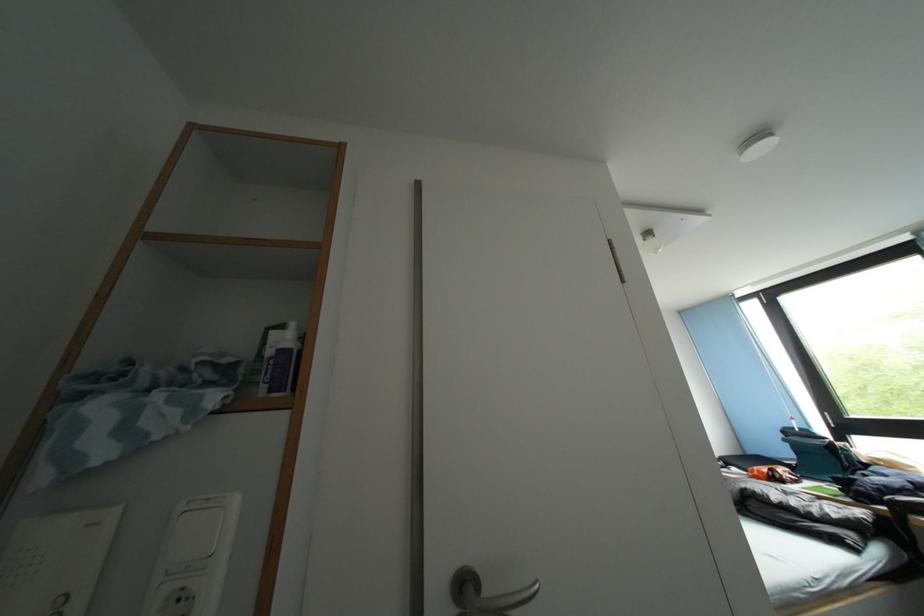
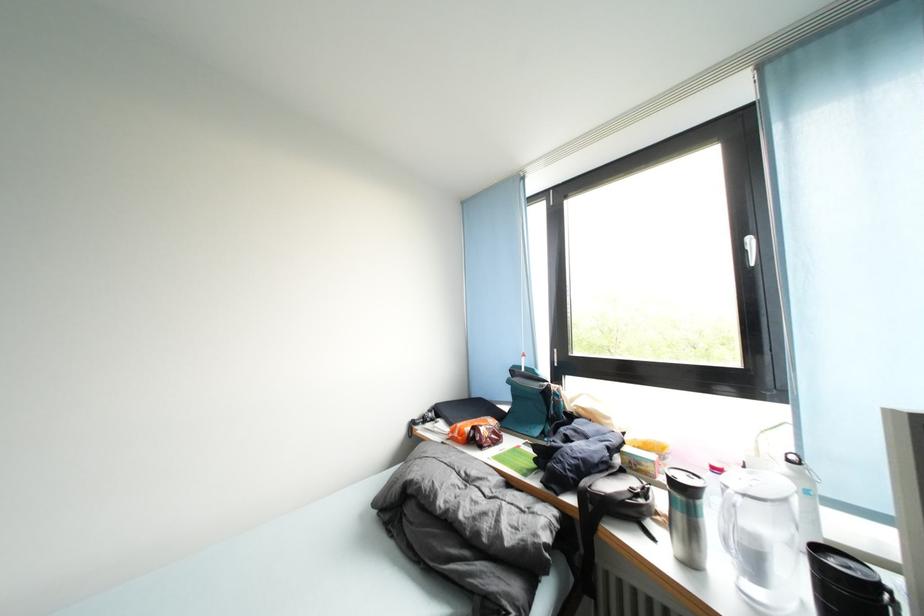
Find the pixel in the second image that matches the point at 891,513 in the first image.

(579, 505)